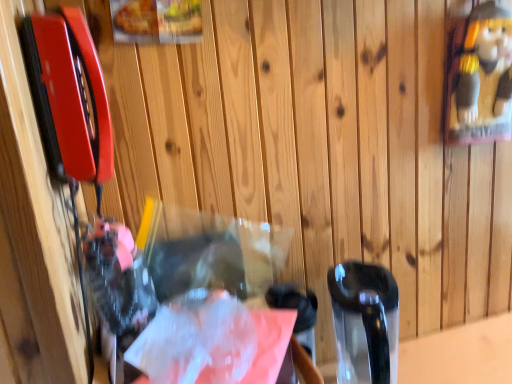
Question: From the image's perspective, is translucent plastic bag at center located beneath translucent plastic bag at center?

Choices:
 (A) no
 (B) yes

Answer: (B)

Question: Is translucent plastic bag at center not within translucent plastic bag at center?

Choices:
 (A) no
 (B) yes

Answer: (B)

Question: Is translucent plastic bag at center behind translucent plastic bag at center?

Choices:
 (A) no
 (B) yes

Answer: (A)

Question: From a real-world perspective, does translucent plastic bag at center stand above translucent plastic bag at center?

Choices:
 (A) yes
 (B) no

Answer: (B)

Question: From a real-world perspective, is translucent plastic bag at center below translucent plastic bag at center?

Choices:
 (A) no
 (B) yes

Answer: (B)

Question: Are translucent plastic bag at center and translucent plastic bag at center far apart?

Choices:
 (A) no
 (B) yes

Answer: (A)

Question: From a real-world perspective, is translucent plastic bag at center positioned over translucent plastic bag at center based on gravity?

Choices:
 (A) no
 (B) yes

Answer: (B)

Question: From the image's perspective, is translucent plastic bag at center on top of translucent plastic bag at center?

Choices:
 (A) no
 (B) yes

Answer: (B)

Question: Does translucent plastic bag at center have a larger size compared to translucent plastic bag at center?

Choices:
 (A) yes
 (B) no

Answer: (B)

Question: Does translucent plastic bag at center have a lesser width compared to translucent plastic bag at center?

Choices:
 (A) no
 (B) yes

Answer: (B)

Question: From the image's perspective, does translucent plastic bag at center appear lower than translucent plastic bag at center?

Choices:
 (A) yes
 (B) no

Answer: (B)

Question: Is translucent plastic bag at center closer to camera compared to translucent plastic bag at center?

Choices:
 (A) yes
 (B) no

Answer: (B)

Question: Does point click(x=185, y=380) appear closer or farther from the camera than point click(x=188, y=256)?

Choices:
 (A) closer
 (B) farther

Answer: (A)